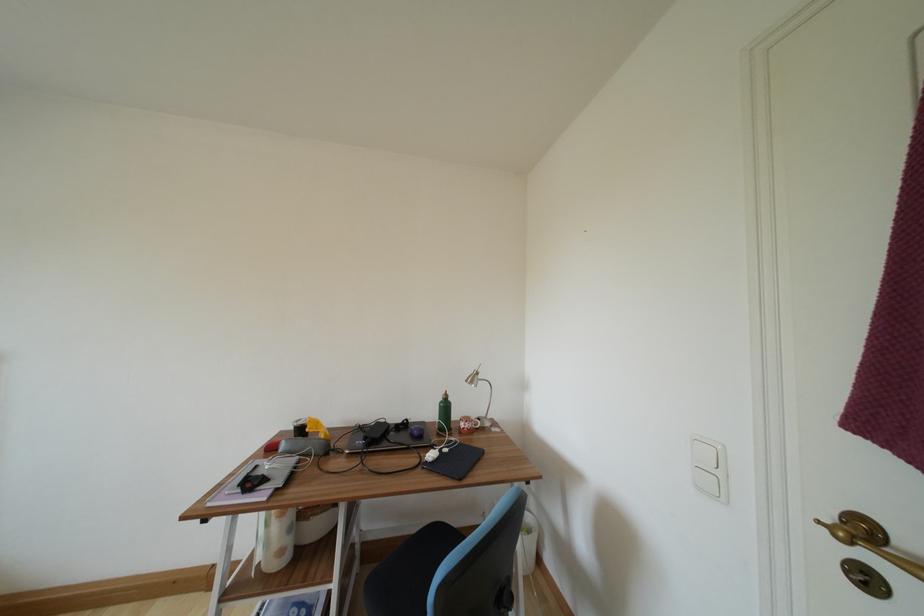
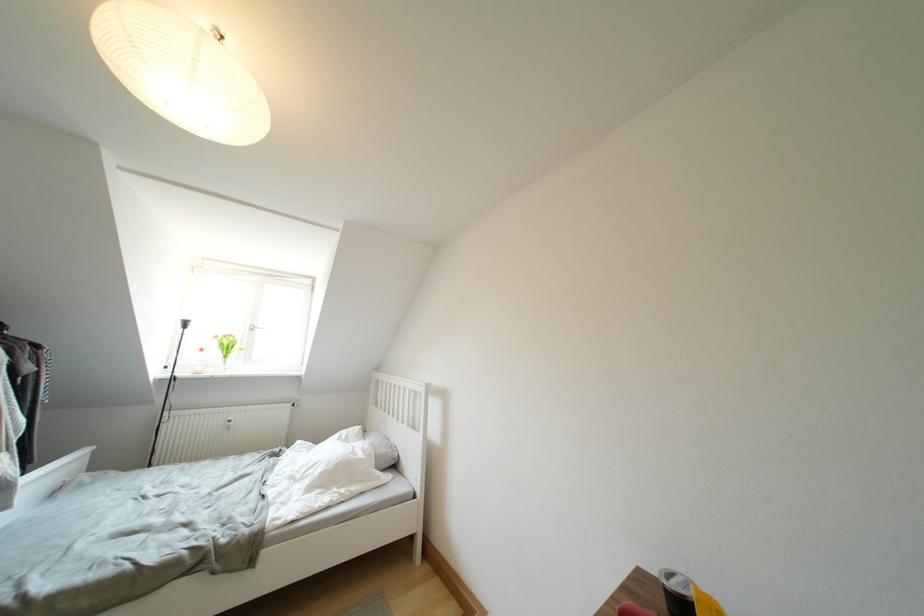
Question: The camera is either moving clockwise (left) or counter-clockwise (right) around the object. The first image is from the beginning of the video and the second image is from the end. Is the camera moving left or right when shooting the video?

Choices:
 (A) Left
 (B) Right

Answer: (B)